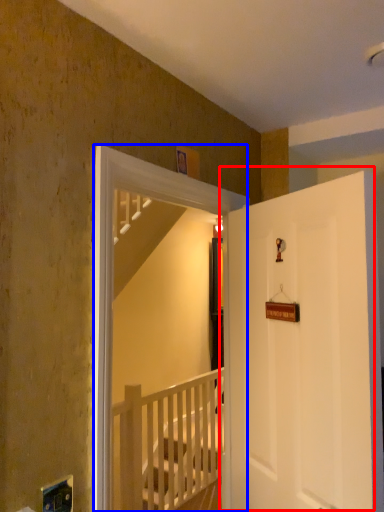
Question: Which point is closer to the camera, door (highlighted by a red box) or screen door (highlighted by a blue box)?

Choices:
 (A) door
 (B) screen door

Answer: (A)